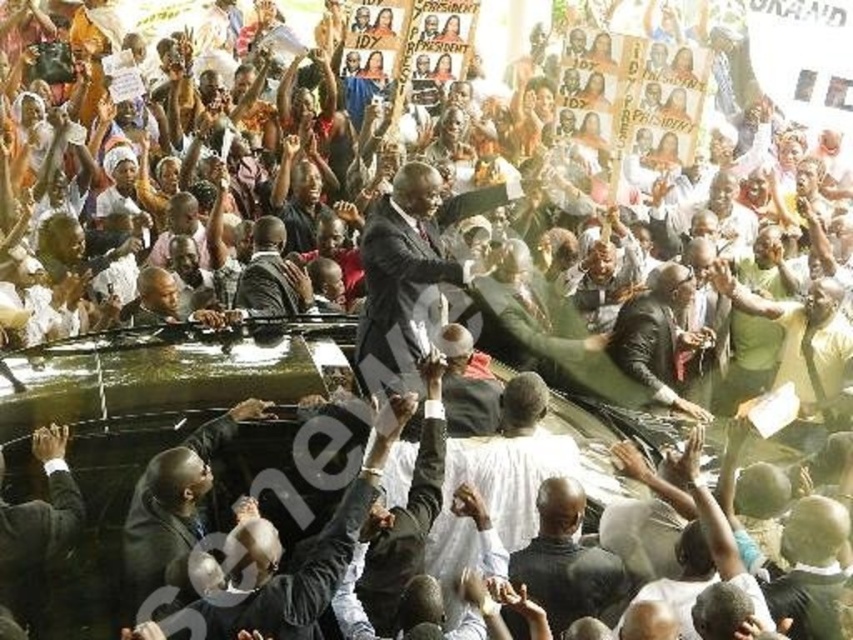
You are standing at the camera position and want to reach the point marked as point (55, 474). If you walk straight ahead, will you reach that point?

Yes, because the point (55, 474) is 51.03 meters from the camera, so walking straight ahead will lead you to it.

You are a photographer at the rally trying to capture a clear photo of both the black suit at center and the green matte shirt at right. Which of the two subjects should you focus on first to ensure they are in frame and properly sized?

The black suit at center has a smaller size compared to green matte shirt at right, so you should focus on the black suit at center first to ensure it is properly sized and in frame before adjusting for the larger green matte shirt at right.

You are a photographer at the rally who wants to capture both the dark gray suit at center and the dark brown suit at center in a single wide shot. Given the camera you have can focus on subjects within 100 feet, will you be able to include both individuals in your photo?

The distance between dark gray suit at center and dark brown suit at center is 96.97 feet, which is less than the camera focus range of 100 feet. Therefore, both individuals can be included in the photo.